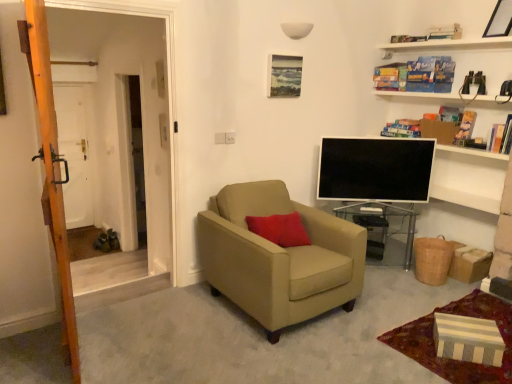
Image resolution: width=512 pixels, height=384 pixels. Identify the location of free point to the left of wooden ladder at left. (45, 340).